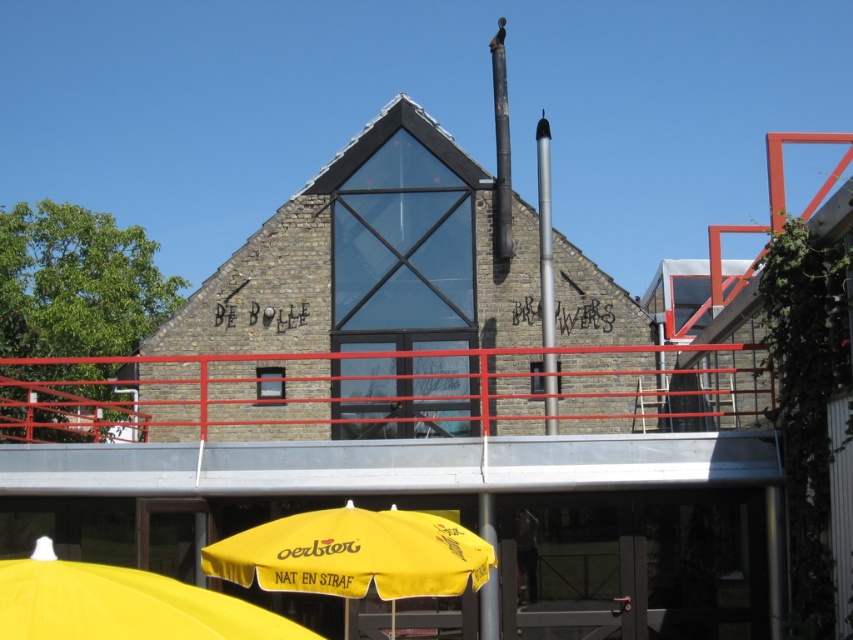
You are standing in front of the modern building and want to place a small potted plant between the red metal railing at center and the yellow fabric umbrella at lower center. Considering their sizes, which object should the plant be closer to?

The red metal railing at center has a larger size compared to yellow fabric umbrella at lower center, so the plant should be placed closer to the yellow fabric umbrella at lower center to maintain balance.